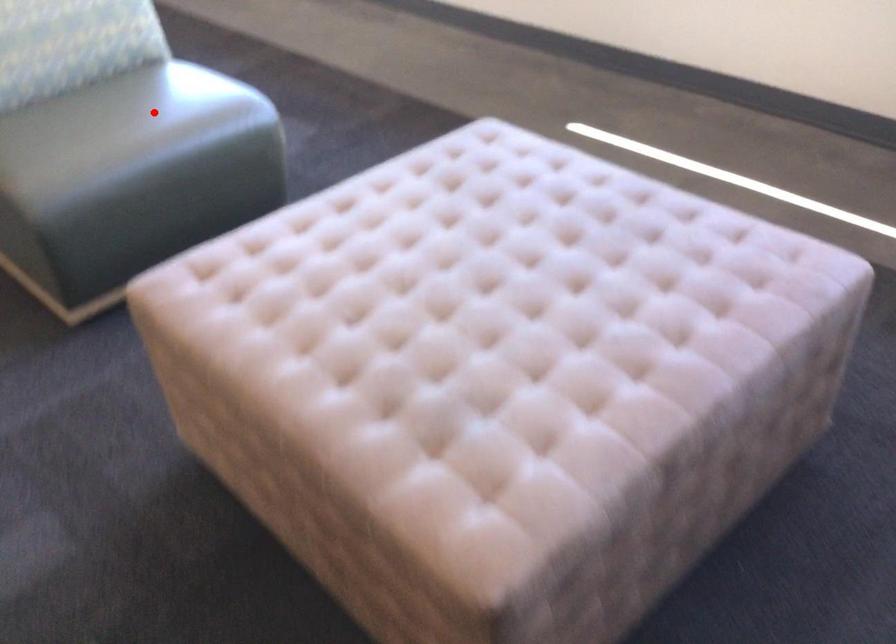
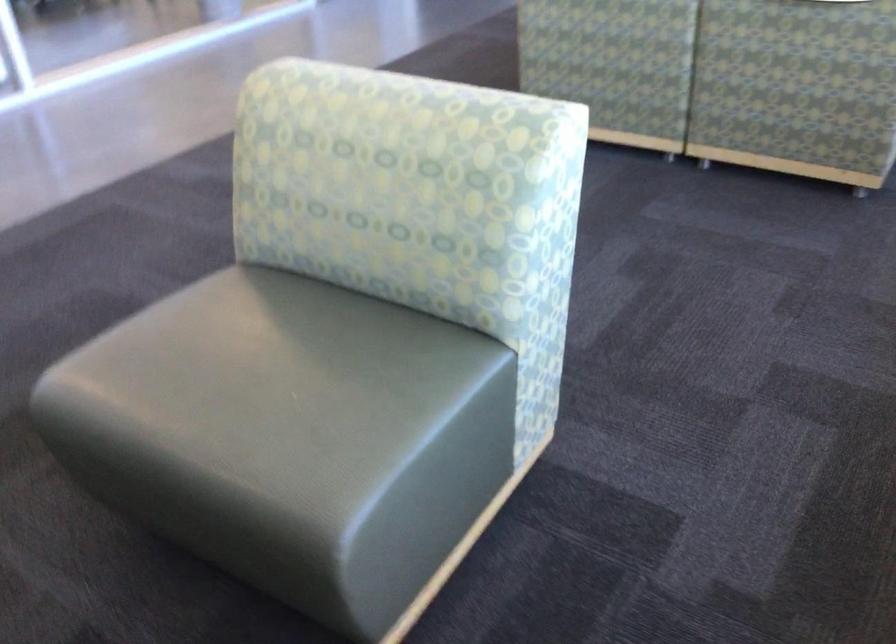
Locate, in the second image, the point that corresponds to the highlighted location in the first image.

(279, 389)